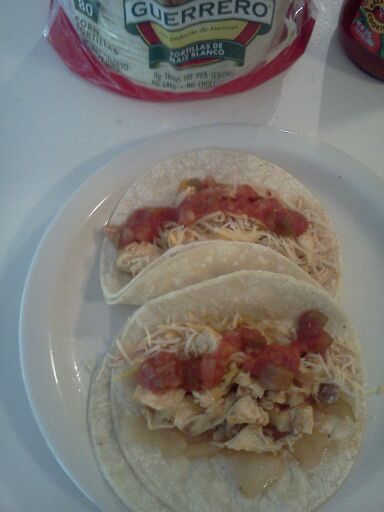
Identify the location of jar. The height and width of the screenshot is (512, 384). (366, 55).